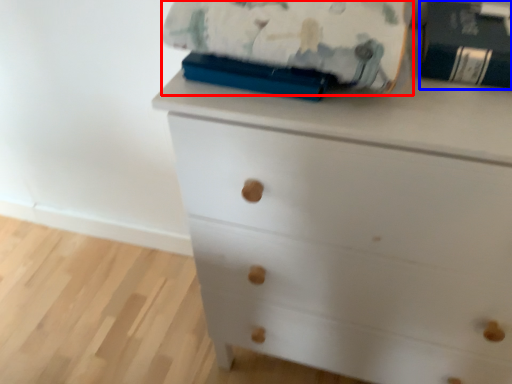
Question: Which of the following is the farthest to the observer, blanket (highlighted by a red box) or paperback book (highlighted by a blue box)?

Choices:
 (A) blanket
 (B) paperback book

Answer: (B)